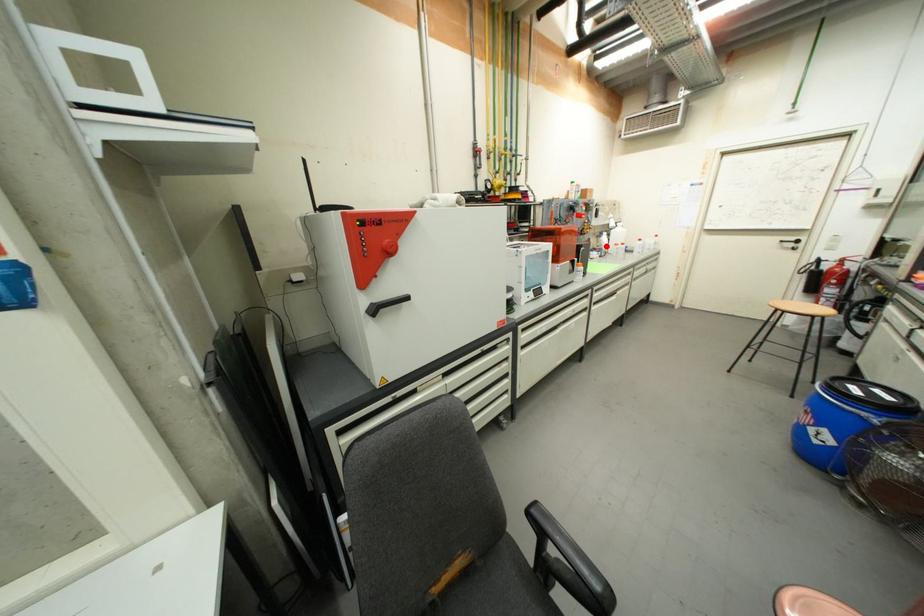
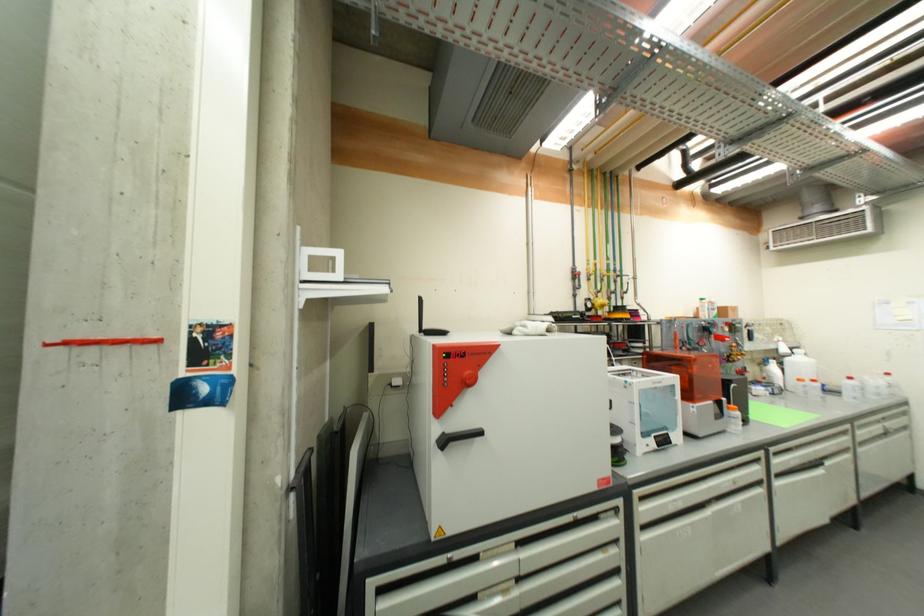
Question: I am providing you with two images of the same scene from different viewpoints. Given a red point in image1, look at the same physical point in image2. Is it:

Choices:
 (A) Closer to the viewpoint
 (B) Farther from the viewpoint

Answer: (A)